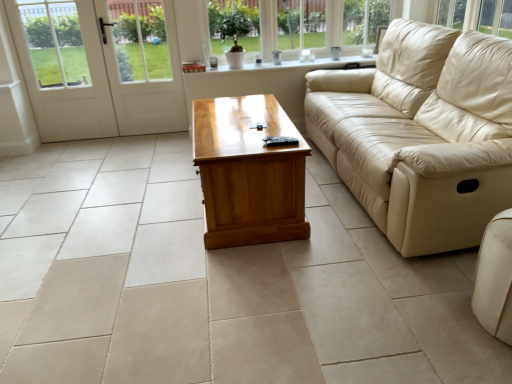
Image resolution: width=512 pixels, height=384 pixels. What are the coordinates of `vacant space that is to the left of white wooden screen door at left` in the screenshot? It's located at (112, 144).